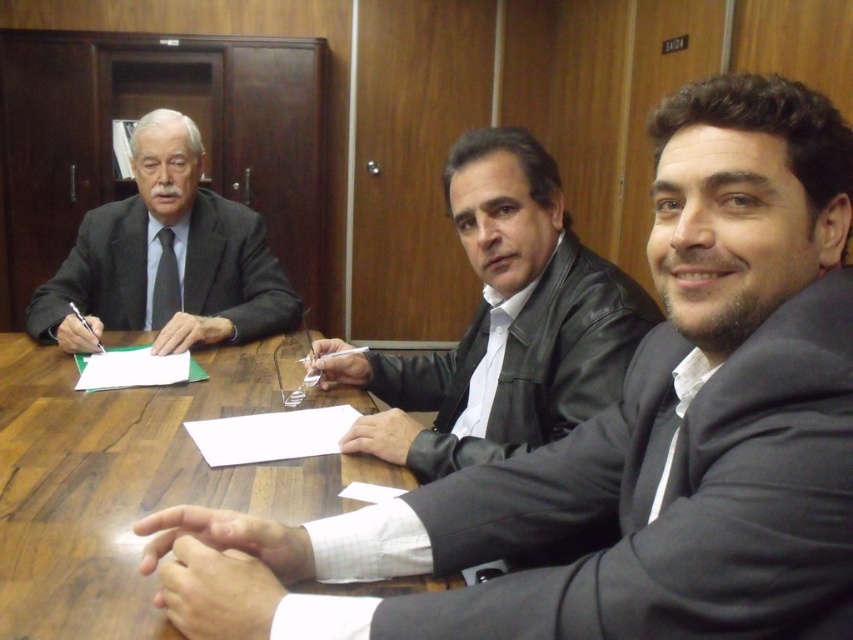
You are organizing a meeting in this room and need to place a 1.5 meter wide banner on the wooden table at center. Considering the leather jacket at center is already on the table, will the banner fit?

The wooden table at center is wider than the leather jacket at center, so the banner may fit depending on available space, but the exact dimensions are not provided. However, since the table is wider than the jacket, there might be enough space for the banner.

You are a guest at this meeting. You need to sit down at the wooden table at center. However, the matte black suit at left is already seated there. Is there enough space for you to sit comfortably next to them?

The wooden table at center is shorter than matte black suit at left, so there might not be enough space for you to sit comfortably next to them.

You are organizing a meeting in a formal room with a wooden table at center and a person wearing a leather jacket at center. If you want to place a large document on the table, which object would be more suitable for this task?

The wooden table at center is bigger than the leather jacket at center, so it is more suitable for placing a large document.